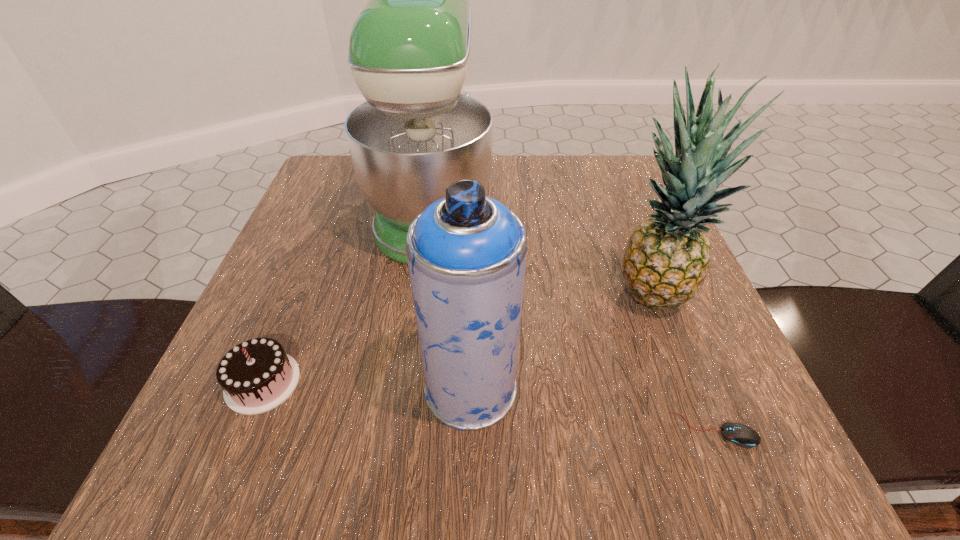
Locate an element on the screen. free space at the far edge is located at coordinates (548, 168).

The image size is (960, 540). In the image, there is a desktop. What are the coordinates of `vacant region at the near edge` in the screenshot? It's located at [x=617, y=421].

Identify the location of vacant position at the left edge of the desktop. (277, 286).

This screenshot has width=960, height=540. In order to click on vacant space at the right edge of the desktop in this screenshot , I will do `click(588, 215)`.

Locate an element on the screen. This screenshot has width=960, height=540. vacant space at the far left corner of the desktop is located at coordinates (372, 211).

You are a GUI agent. You are given a task and a screenshot of the screen. Output one action in this format:
    pyautogui.click(x=<x>, y=<y>)
    Task: Click on the vacant space at the far right corner of the desktop
    This screenshot has height=540, width=960.
    Given the screenshot: What is the action you would take?
    pyautogui.click(x=593, y=161)

At what (x,y) coordinates should I click in order to perform the action: click on free location at the near right corner. Please return your answer as a coordinate pair (x, y). Image resolution: width=960 pixels, height=540 pixels. Looking at the image, I should click on (762, 430).

Identify the location of empty location between the pineapple and the aerosol can. (560, 342).

The width and height of the screenshot is (960, 540). I want to click on vacant space that's between the mixer and the pineapple, so click(x=540, y=251).

Identify the location of unoccupied position between the aerosol can and the leftmost object. (367, 386).